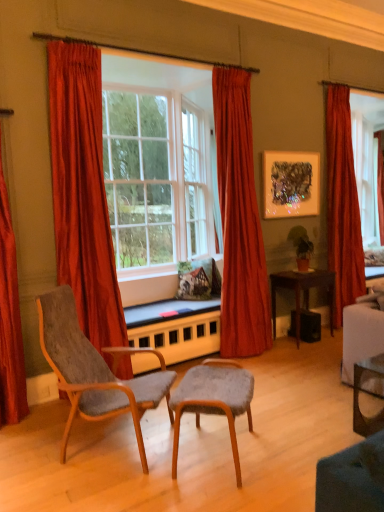
The width and height of the screenshot is (384, 512). Find the location of `free space to the right of velvet grey stool at center, placed as the 1th chair when sorted from right to left`. free space to the right of velvet grey stool at center, placed as the 1th chair when sorted from right to left is located at coordinates (284, 442).